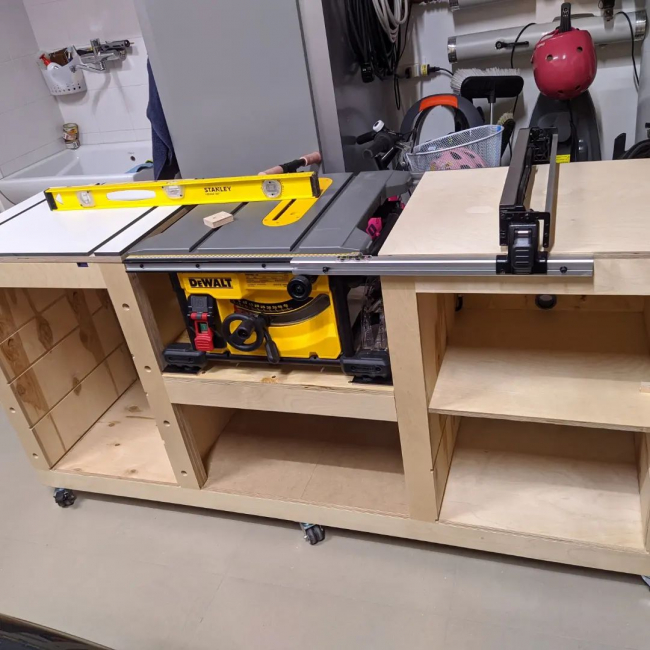
Find the location of a particular element. Image resolution: width=650 pixels, height=650 pixels. faucet is located at coordinates (96, 52).